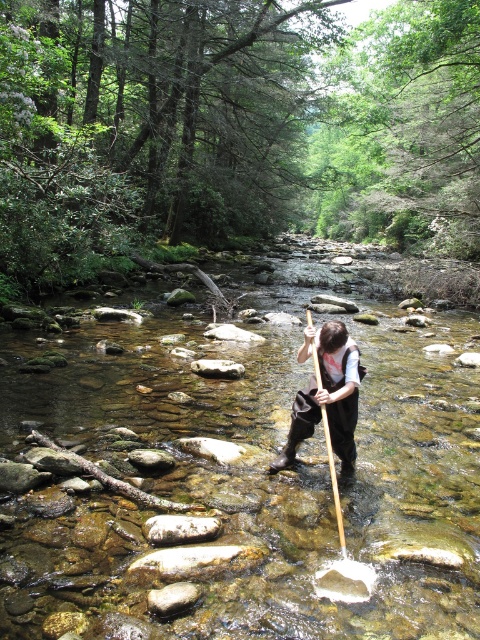
Question: Which of the following is the farthest from the observer?

Choices:
 (A) wooden paddle at center
 (B) brown leather boots at center
 (C) clear stone river at center

Answer: (B)

Question: Does brown leather boots at center come behind wooden paddle at center?

Choices:
 (A) no
 (B) yes

Answer: (B)

Question: Is brown leather boots at center smaller than wooden paddle at center?

Choices:
 (A) yes
 (B) no

Answer: (A)

Question: Which point is farther to the camera?

Choices:
 (A) (336, 376)
 (B) (331, 461)
 (C) (203, 432)

Answer: (C)

Question: In this image, where is brown leather boots at center located relative to wooden paddle at center?

Choices:
 (A) below
 (B) above

Answer: (A)

Question: Which of the following is the closest to the observer?

Choices:
 (A) (348, 374)
 (B) (315, 380)
 (C) (190, 422)

Answer: (A)